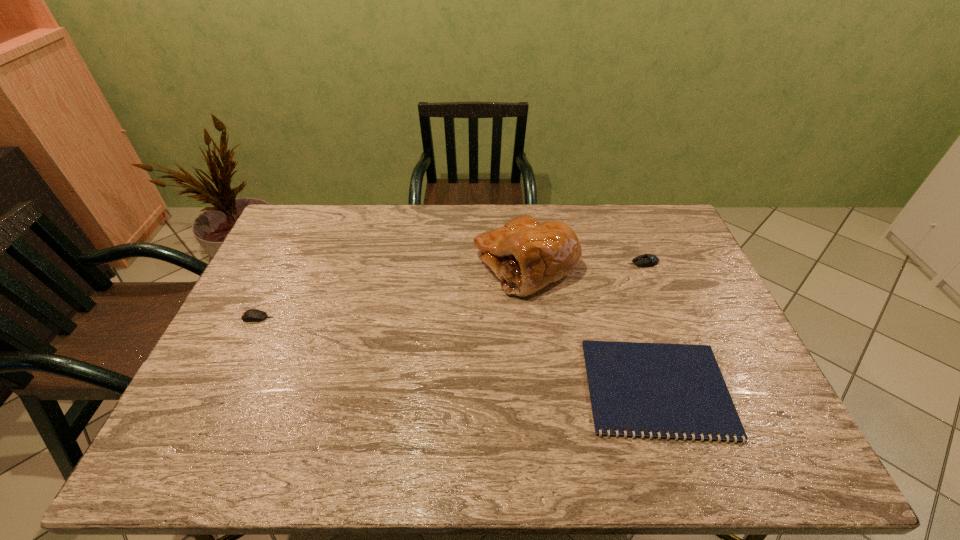
Identify the location of free space between the second shortest object and the right computer mouse. (450, 290).

The width and height of the screenshot is (960, 540). What are the coordinates of `vacant region between the bread and the shortest object` in the screenshot? It's located at (591, 327).

At what (x,y) coordinates should I click in order to perform the action: click on empty space between the bread and the nearest object. Please return your answer as a coordinate pair (x, y). Image resolution: width=960 pixels, height=540 pixels. Looking at the image, I should click on pyautogui.click(x=591, y=327).

Locate an element on the screen. Image resolution: width=960 pixels, height=540 pixels. object that is the closest to the shorter computer mouse is located at coordinates (526, 255).

Identify which object is located as the third nearest to the notepad. Please provide its 2D coordinates. Your answer should be formatted as a tuple, i.e. [(x, y)], where the tuple contains the x and y coordinates of a point satisfying the conditions above.

[(252, 315)]

The height and width of the screenshot is (540, 960). I want to click on free spot that satisfies the following two spatial constraints: 1. on the filling side of the notepad; 2. on the right side of the bread, so click(x=540, y=389).

Where is `free region that satisfies the following two spatial constraints: 1. on the filling side of the shortest object; 2. on the right side of the bread`? This screenshot has width=960, height=540. free region that satisfies the following two spatial constraints: 1. on the filling side of the shortest object; 2. on the right side of the bread is located at coordinates (540, 389).

Identify the location of free region that satisfies the following two spatial constraints: 1. on the filling side of the shortest object; 2. on the left side of the bread. This screenshot has width=960, height=540. (540, 389).

Identify the location of free location that satisfies the following two spatial constraints: 1. on the filling side of the tallest object; 2. on the right side of the nearest object. The image size is (960, 540). (540, 389).

In order to click on vacant space that satisfies the following two spatial constraints: 1. on the front side of the right computer mouse; 2. on the filling side of the bread in this screenshot , I will do `click(644, 265)`.